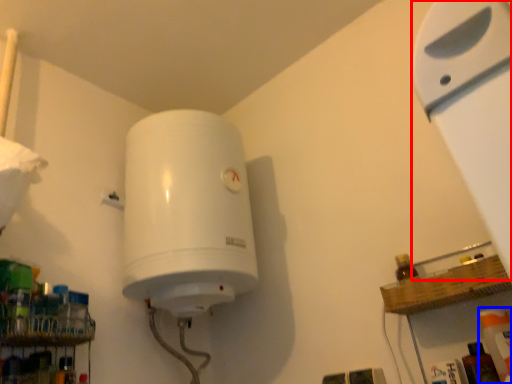
Question: Which object appears farthest to the camera in this image, wide (highlighted by a red box) or cleaning product (highlighted by a blue box)?

Choices:
 (A) wide
 (B) cleaning product

Answer: (B)